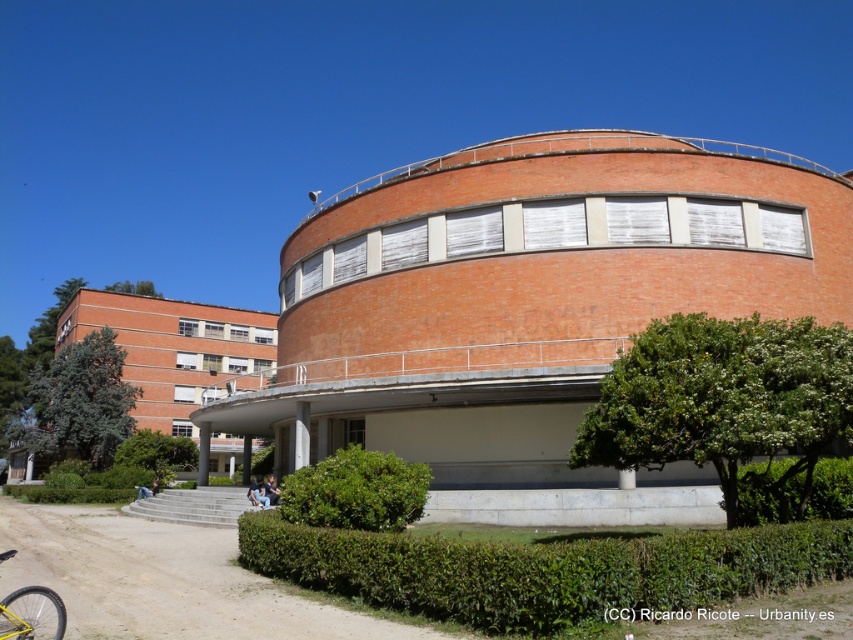
Which is behind, point (668, 317) or point (39, 605)?

Positioned behind is point (668, 317).

Is point (849, 440) farther from viewer compared to point (12, 605)?

That is True.

Between point (653, 444) and point (39, 604), which one is positioned in front?

Positioned in front is point (39, 604).

This screenshot has height=640, width=853. Identify the location of green leafy hedge at lower right. (723, 401).

Who is shorter, green leafy hedge at lower right or light blue jeans at lower center?

Standing shorter between the two is green leafy hedge at lower right.

Which is below, green leafy hedge at lower right or light blue jeans at lower center?

Positioned lower is light blue jeans at lower center.

Image resolution: width=853 pixels, height=640 pixels. What are the coordinates of `green leafy hedge at lower right` in the screenshot? It's located at (723, 401).

At what (x,y) coordinates should I click in order to perform the action: click on green leafy hedge at lower right. Please return your answer as a coordinate pair (x, y). Looking at the image, I should click on (723, 401).

Who is lower down, green leafy hedge at lower right or green leafy hedge at lower left?

Positioned lower is green leafy hedge at lower left.

Is green leafy hedge at lower right positioned at the back of green leafy hedge at lower left?

That is False.

This screenshot has width=853, height=640. I want to click on green leafy hedge at lower right, so click(723, 401).